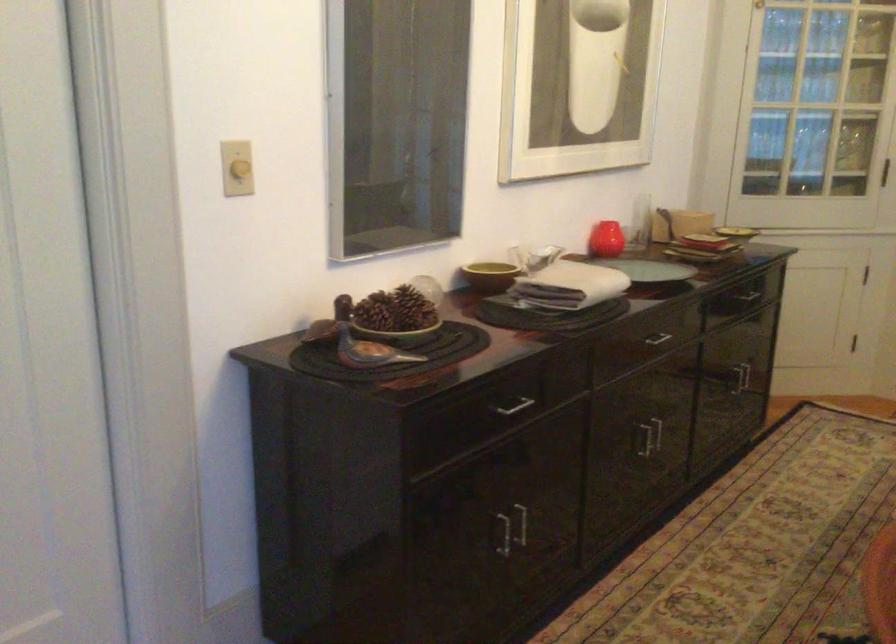
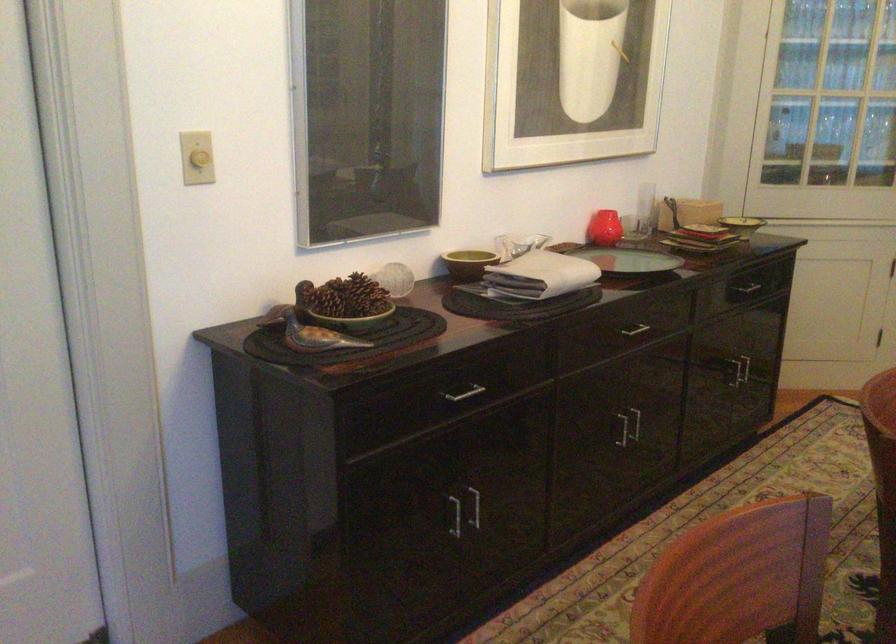
Where in the second image is the point corresponding to point 366,348 from the first image?

(312, 333)